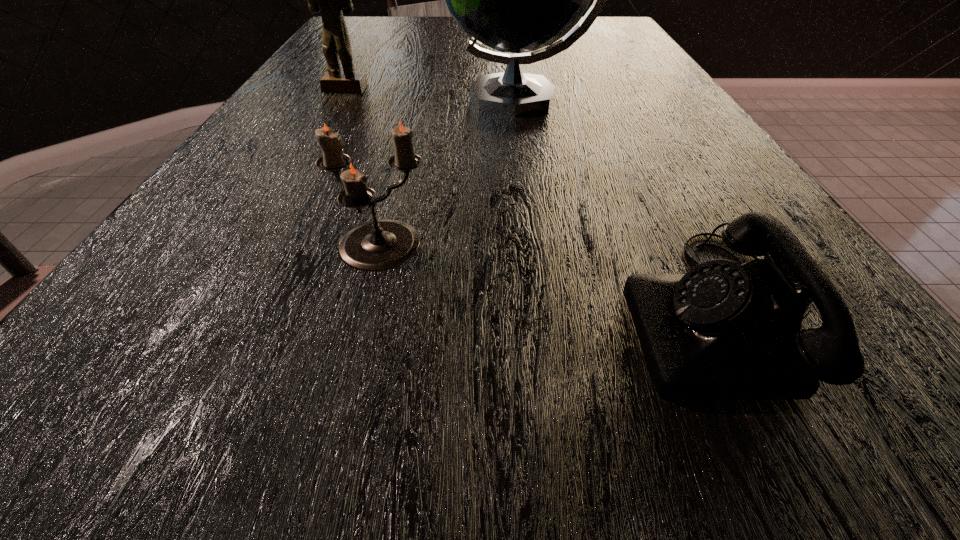
Identify the location of the tallest object. The image size is (960, 540). (514, 0).

Where is `figurine`? The height and width of the screenshot is (540, 960). figurine is located at coordinates (330, 0).

Image resolution: width=960 pixels, height=540 pixels. In order to click on the leftmost object in this screenshot , I will do `click(330, 0)`.

Locate an element on the screen. Image resolution: width=960 pixels, height=540 pixels. the second shortest object is located at coordinates (377, 245).

The height and width of the screenshot is (540, 960). I want to click on the shortest object, so click(723, 331).

You are a GUI agent. You are given a task and a screenshot of the screen. Output one action in this format:
    pyautogui.click(x=<x>, y=<y>)
    Task: Click on the vacant area located 0.310m on the front surface of the tallest object
    The height and width of the screenshot is (540, 960).
    Given the screenshot: What is the action you would take?
    pyautogui.click(x=298, y=98)

Locate an element on the screen. The width and height of the screenshot is (960, 540). vacant point located 0.060m on the front surface of the tallest object is located at coordinates (415, 98).

In order to click on vacant area situated on the front surface of the tallest object in this screenshot , I will do `click(340, 98)`.

The image size is (960, 540). What are the coordinates of `free spot located on the front-facing side of the figurine` in the screenshot? It's located at (302, 167).

This screenshot has width=960, height=540. Identify the location of blank area located 0.060m on the left of the candle holder. (284, 248).